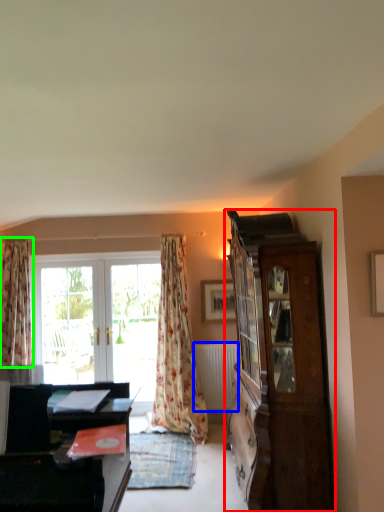
Question: Which object is positioned farthest from cabinetry (highlighted by a red box)? Select from radiator (highlighted by a blue box) and curtain (highlighted by a green box).

Choices:
 (A) radiator
 (B) curtain

Answer: (B)